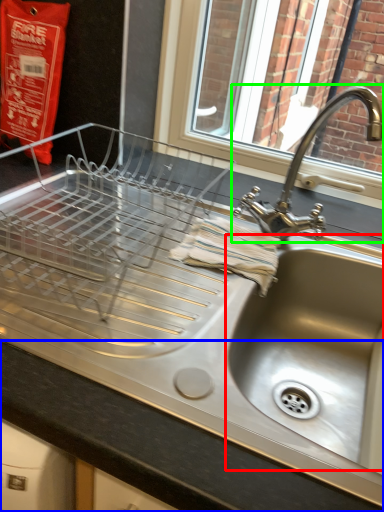
Question: Which is nearer to the sink (highlighted by a red box)? counter top (highlighted by a blue box) or tap (highlighted by a green box).

Choices:
 (A) counter top
 (B) tap

Answer: (B)